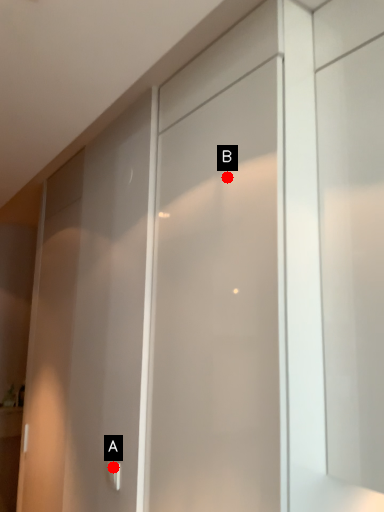
Question: Two points are circled on the image, labeled by A and B beside each circle. Which of the following is the farthest from the observer?

Choices:
 (A) A is further
 (B) B is further

Answer: (A)